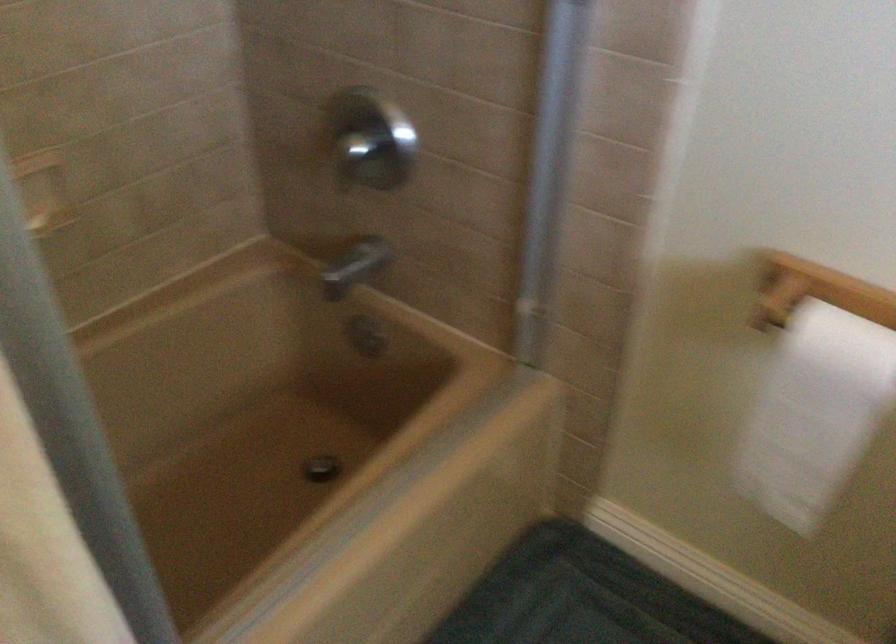
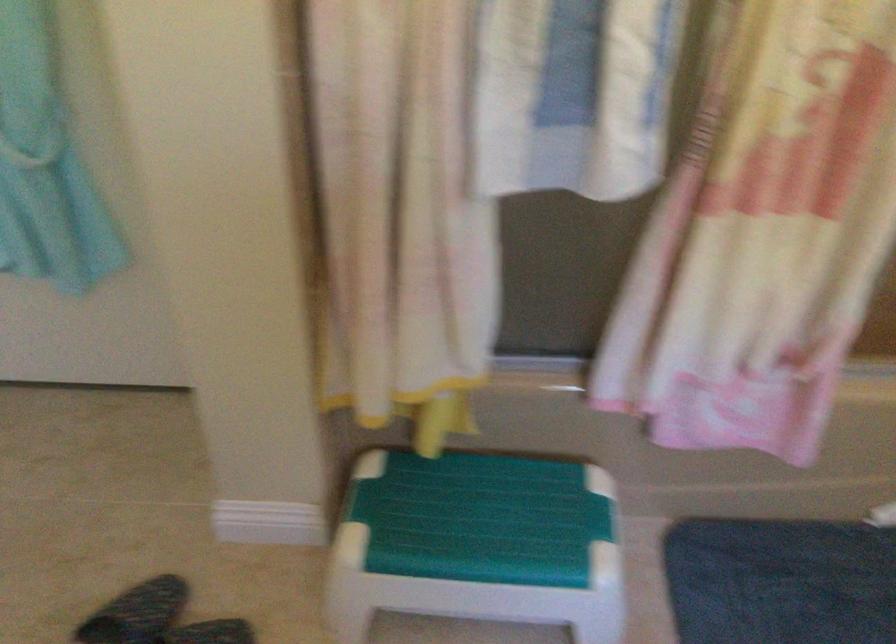
Question: How did the camera likely rotate?

Choices:
 (A) Left
 (B) Right
 (C) Up
 (D) Down

Answer: (A)